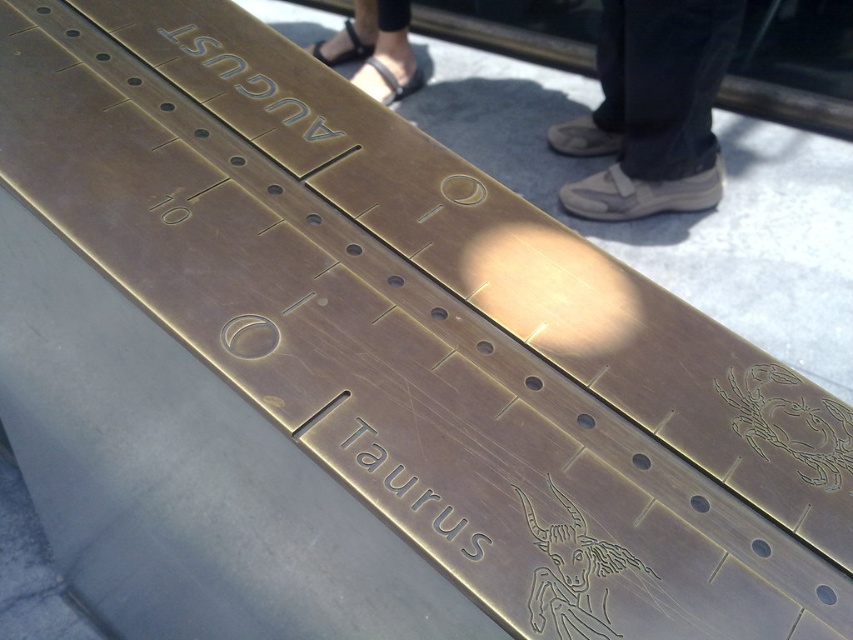
Question: Which object is closer to the camera taking this photo?

Choices:
 (A) gray fabric shoe at upper right
 (B) black leather sandals at upper center
 (C) dark brown leather shoe at upper center

Answer: (A)

Question: Which point is closer to the camera?

Choices:
 (A) (352, 52)
 (B) (396, 48)

Answer: (B)

Question: Is dark brown leather shoe at upper center positioned behind gray fabric shoe at upper right?

Choices:
 (A) no
 (B) yes

Answer: (B)

Question: Which is nearer to the gray fabric shoe at upper right?

Choices:
 (A) dark brown leather shoe at upper center
 (B) black leather sandals at upper center

Answer: (A)

Question: From the image, what is the correct spatial relationship of gray fabric shoe at upper right in relation to black leather sandals at upper center?

Choices:
 (A) above
 (B) below

Answer: (B)

Question: Can you confirm if dark brown leather shoe at upper center is positioned above black leather sandals at upper center?

Choices:
 (A) no
 (B) yes

Answer: (A)